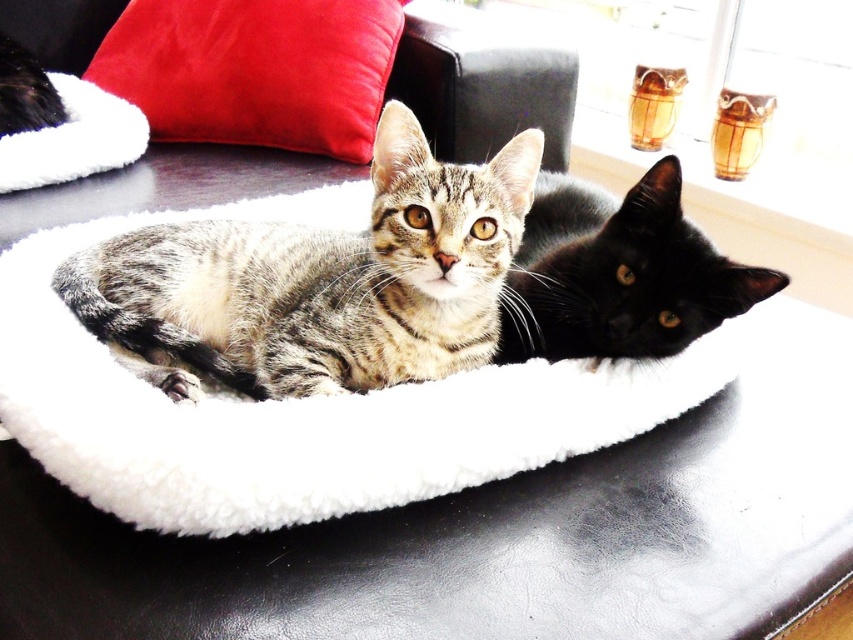
Can you confirm if satin red pillow at upper left is positioned to the left of black glossy cat at center?

Yes, satin red pillow at upper left is to the left of black glossy cat at center.

Is satin red pillow at upper left above black glossy cat at center?

Yes.

Does point (114, 42) lie in front of point (614, 353)?

No, it is not.

The width and height of the screenshot is (853, 640). What are the coordinates of `satin red pillow at upper left` in the screenshot? It's located at (254, 70).

Is white fluffy cat bed at center to the left of black glossy cat at center from the viewer's perspective?

Correct, you'll find white fluffy cat bed at center to the left of black glossy cat at center.

Describe the element at coordinates (302, 406) in the screenshot. This screenshot has width=853, height=640. I see `white fluffy cat bed at center` at that location.

The image size is (853, 640). What do you see at coordinates (302, 406) in the screenshot?
I see `white fluffy cat bed at center` at bounding box center [302, 406].

I want to click on white fluffy cat bed at center, so click(302, 406).

The height and width of the screenshot is (640, 853). I want to click on white fluffy cat bed at center, so click(x=302, y=406).

Who is higher up, white fluffy cat bed at center or tabby fur cat at center?

tabby fur cat at center is higher up.

Measure the distance between point (387, 465) and camera.

Point (387, 465) and camera are 3.44 feet apart from each other.

What are the coordinates of `white fluffy cat bed at center` in the screenshot? It's located at (302, 406).